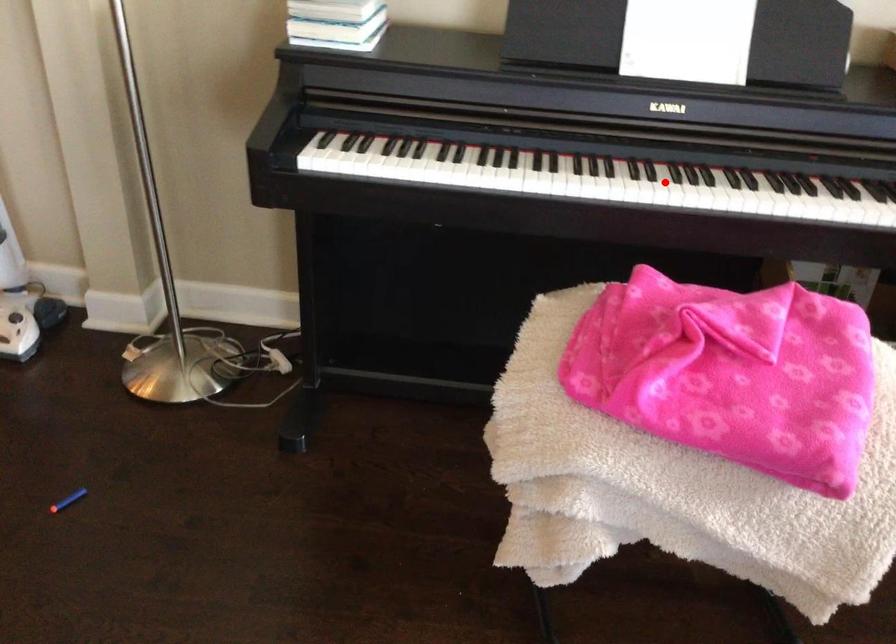
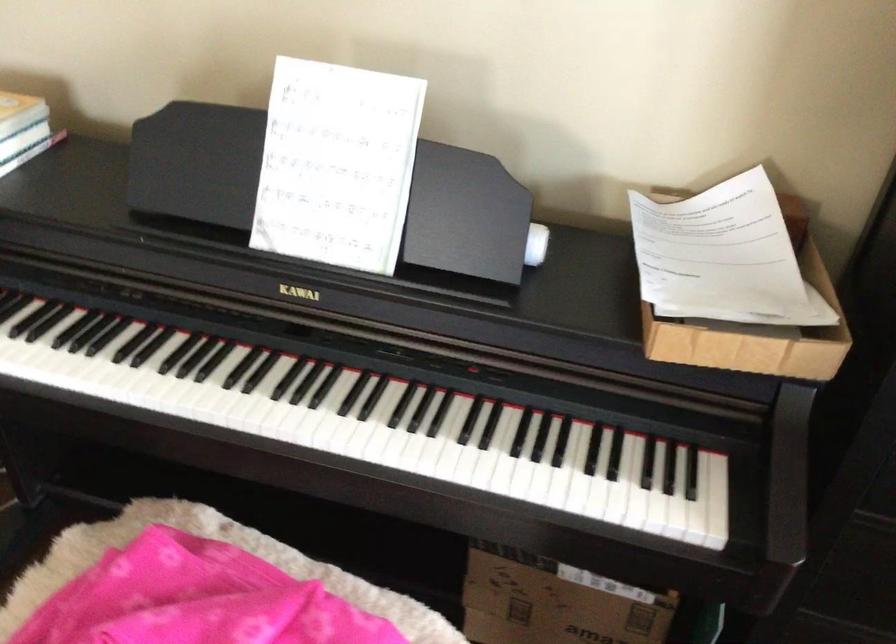
Question: I am providing you with two images of the same scene from different viewpoints. Given a red point in image1, look at the same physical point in image2. Is it:

Choices:
 (A) Closer to the viewpoint
 (B) Farther from the viewpoint

Answer: (A)